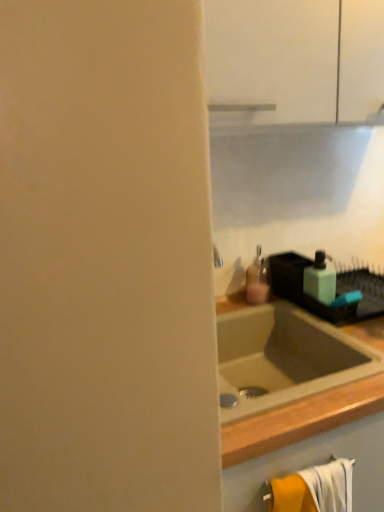
Question: In which direction should I rotate to look at matte pink plastic soap dispenser at center, placed as the 1th soap dispenser when sorted from left to right?

Choices:
 (A) left
 (B) right

Answer: (B)

Question: From a real-world perspective, is green matte soap dispenser at right, which is the 1th soap dispenser from right to left, below orange cotton bath towel at lower right?

Choices:
 (A) yes
 (B) no

Answer: (B)

Question: Considering the relative sizes of green matte soap dispenser at right, which is the 1th soap dispenser from right to left, and orange cotton bath towel at lower right in the image provided, is green matte soap dispenser at right, which is the 1th soap dispenser from right to left, thinner than orange cotton bath towel at lower right?

Choices:
 (A) yes
 (B) no

Answer: (B)

Question: Considering the relative sizes of green matte soap dispenser at right, which is the 2th soap dispenser in left-to-right order, and orange cotton bath towel at lower right in the image provided, is green matte soap dispenser at right, which is the 2th soap dispenser in left-to-right order, wider than orange cotton bath towel at lower right?

Choices:
 (A) yes
 (B) no

Answer: (A)

Question: From the image's perspective, would you say green matte soap dispenser at right, which is the 2th soap dispenser in left-to-right order, is shown under orange cotton bath towel at lower right?

Choices:
 (A) no
 (B) yes

Answer: (A)

Question: Is green matte soap dispenser at right, which is the 1th soap dispenser from right to left, far from orange cotton bath towel at lower right?

Choices:
 (A) yes
 (B) no

Answer: (B)

Question: Is green matte soap dispenser at right, which is the 1th soap dispenser from right to left, facing away from orange cotton bath towel at lower right?

Choices:
 (A) no
 (B) yes

Answer: (A)

Question: Is orange cotton bath towel at lower right wider than green matte soap dispenser at right, which is the 2th soap dispenser in left-to-right order?

Choices:
 (A) no
 (B) yes

Answer: (A)

Question: Is orange cotton bath towel at lower right far from green matte soap dispenser at right, which is the 2th soap dispenser in left-to-right order?

Choices:
 (A) no
 (B) yes

Answer: (A)

Question: Does orange cotton bath towel at lower right have a smaller size compared to green matte soap dispenser at right, which is the 1th soap dispenser from right to left?

Choices:
 (A) yes
 (B) no

Answer: (B)

Question: Considering the relative sizes of orange cotton bath towel at lower right and green matte soap dispenser at right, which is the 1th soap dispenser from right to left, in the image provided, is orange cotton bath towel at lower right shorter than green matte soap dispenser at right, which is the 1th soap dispenser from right to left,?

Choices:
 (A) no
 (B) yes

Answer: (A)

Question: From a real-world perspective, does orange cotton bath towel at lower right sit lower than green matte soap dispenser at right, which is the 1th soap dispenser from right to left?

Choices:
 (A) no
 (B) yes

Answer: (B)

Question: Is orange cotton bath towel at lower right directly adjacent to green matte soap dispenser at right, which is the 1th soap dispenser from right to left?

Choices:
 (A) no
 (B) yes

Answer: (A)

Question: Considering the relative sizes of matte pink plastic soap dispenser at center, placed as the 1th soap dispenser when sorted from left to right, and green matte soap dispenser at right, which is the 1th soap dispenser from right to left, in the image provided, is matte pink plastic soap dispenser at center, placed as the 1th soap dispenser when sorted from left to right, thinner than green matte soap dispenser at right, which is the 1th soap dispenser from right to left,?

Choices:
 (A) yes
 (B) no

Answer: (A)